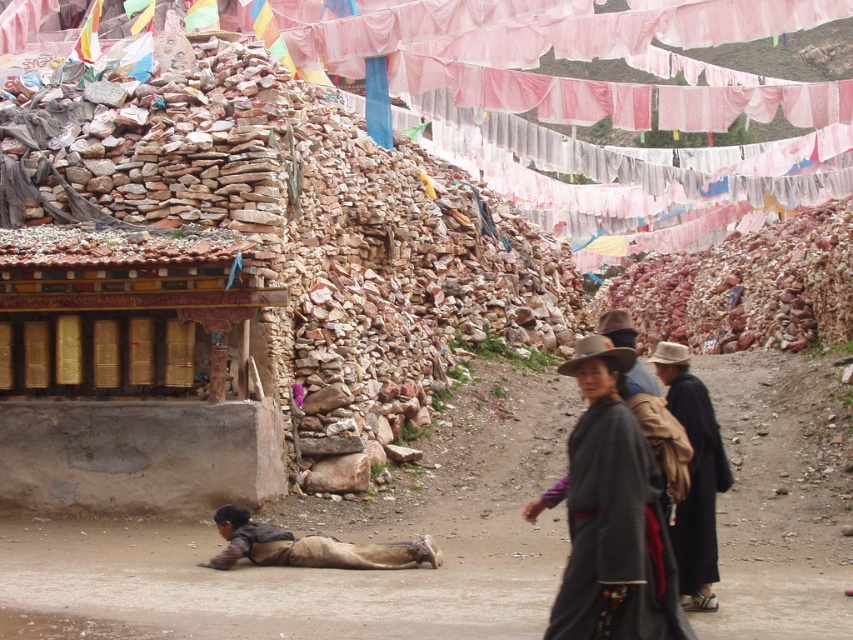
You are a traveler on the dirt path and want to know which object is bigger between the gold metallic prayer wheel at lower left and the brown leather pants at lower center. Can you tell me?

The gold metallic prayer wheel at lower left is larger in size than the brown leather pants at lower center.

In the scene shown: You are a photographer trying to capture the scene. You notice a point at coordinates (695, 483) on the image. Which object in the scene does this point belong to?

The point at coordinates (695, 483) is on the black woolen robe at lower right.

You are a traveler on the dirt path and want to take a photo of both the black woolen robe at lower right and the brown felt hat at center. Which object should you focus on first if you want to capture both in the same frame?

The black woolen robe at lower right is positioned on the left side of brown felt hat at center, so you should focus on the black woolen robe at lower right first to ensure both are in the same frame.